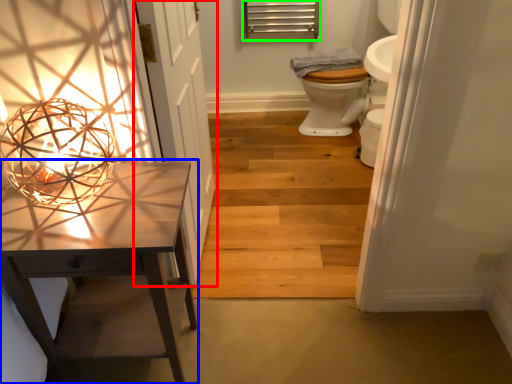
Question: Estimate the real-world distances between objects in this image. Which object is farther from door (highlighted by a red box), table (highlighted by a blue box) or shutter (highlighted by a green box)?

Choices:
 (A) table
 (B) shutter

Answer: (B)